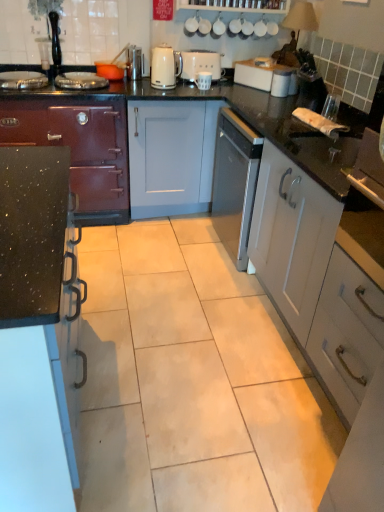
Identify the location of vacant area that is in front of white glossy kettle at upper center. (165, 91).